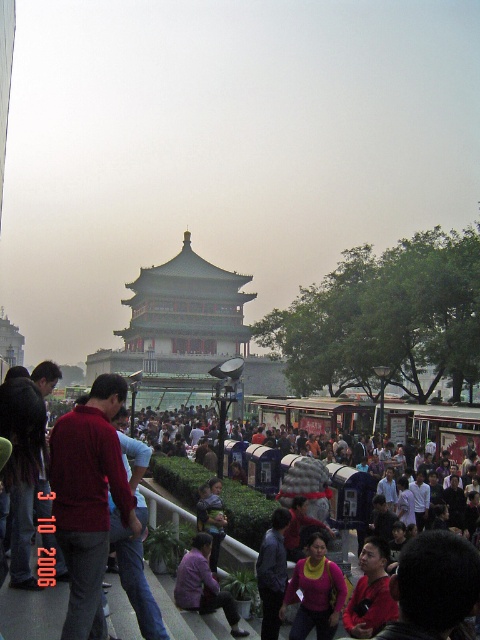
You are standing in the public square and want to walk towards the pagoda. There are two points marked on the ground ahead of you. One is labeled as point (182, 604) and the other is point (261, 592). Which point should you step on first to stay on the path leading directly to the pagoda?

Point (182, 604) should be stepped on first because it is in front of point (261, 592), meaning it is closer to the pagoda along the path.

In the scene shown: You are a delivery person carrying a box that requires a signature. You see a person wearing a matte pink sweater at center and another wearing a purple fabric shirt at lower center. Which person is closer to you if you are standing at the entrance of the pagoda?

The purple fabric shirt at lower center is closer since it is located at lower center compared to the matte pink sweater at center, which is further away from the entrance.